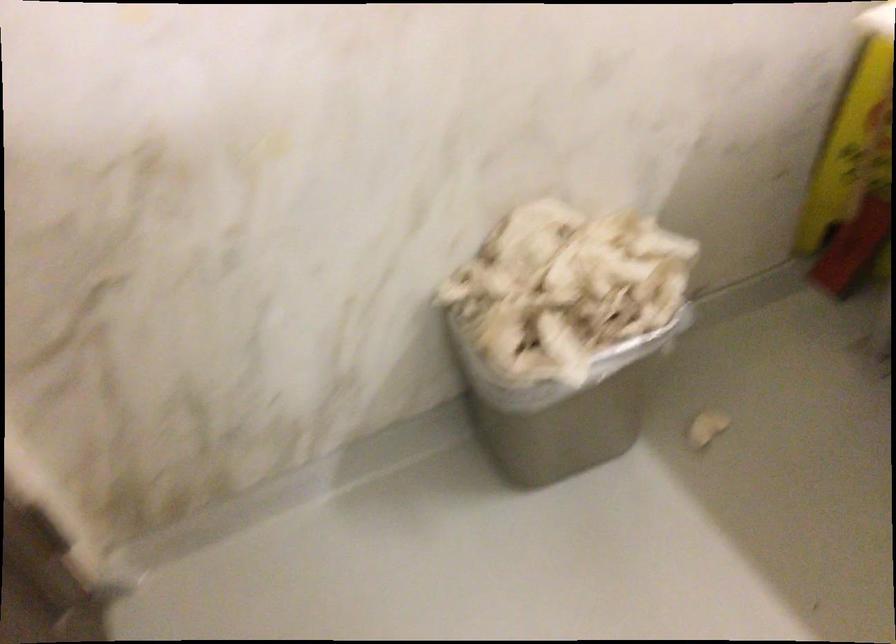
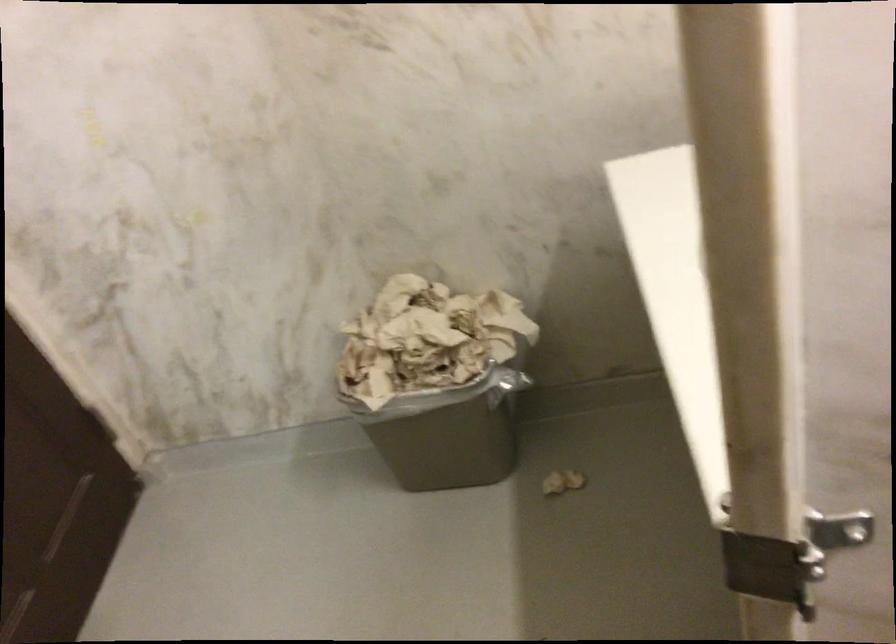
The point at (617,395) is marked in the first image. Where is the corresponding point in the second image?

(449, 431)